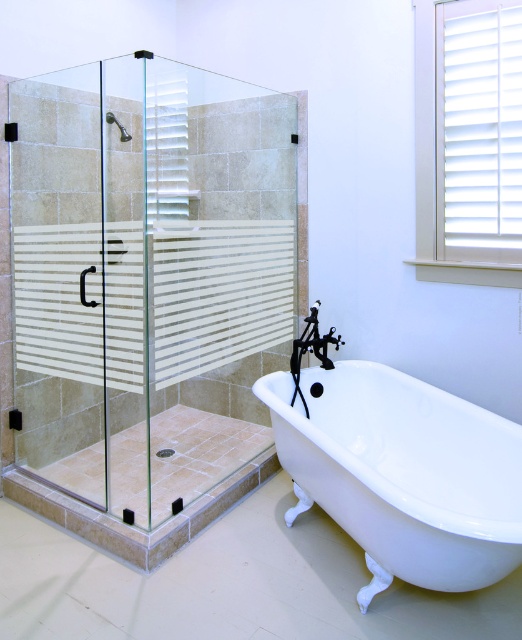
You are standing in the bathroom and want to reach the point at coordinate [231,193]. Is this point within your immediate reach without moving your feet?

The point at coordinate [231,193] is 11.07 feet away from you, so it is too far to reach without moving your feet.

You are standing in the bathroom and want to determine which of the two points, point [193,452] or point [121,129], is closer to you. Based on the bathroom layout described, which point is nearer?

Point [193,452] is further to the viewer than point [121,129], so the closer point to you is point [121,129].

You are standing in the bathroom and want to place a small plant between the two points, point (274, 401) and point (128, 136). Which point should the plant be closer to in order to be nearer to the viewer?

The plant should be closer to point (274, 401) because it is closer to the viewer than point (128, 136).